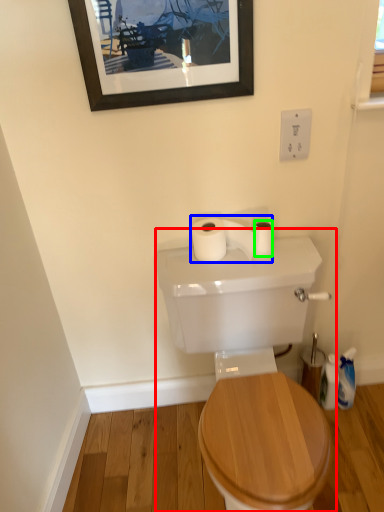
Question: Which object is positioned farthest from sink (highlighted by a red box)? Select from toilet paper (highlighted by a blue box) and toilet paper (highlighted by a green box).

Choices:
 (A) toilet paper
 (B) toilet paper

Answer: (B)